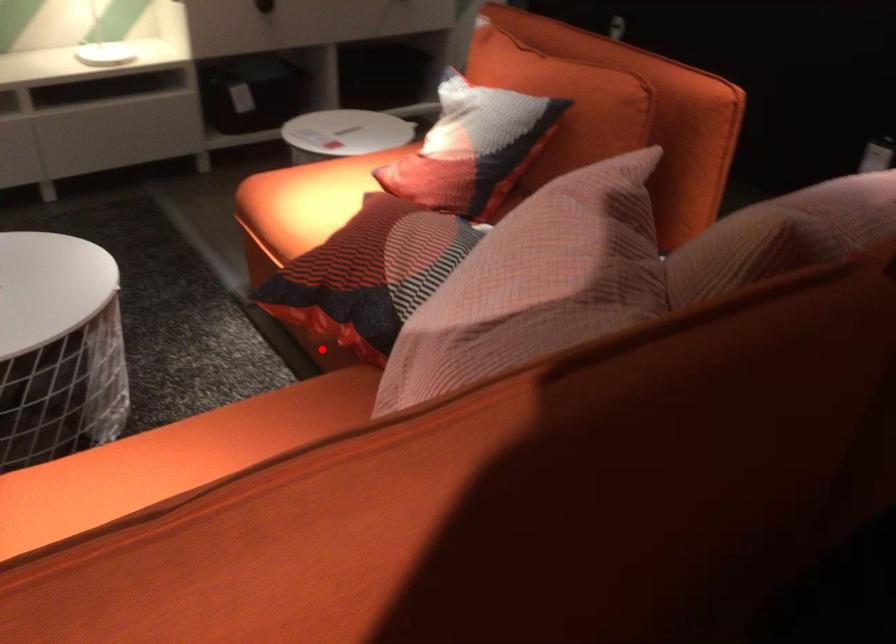
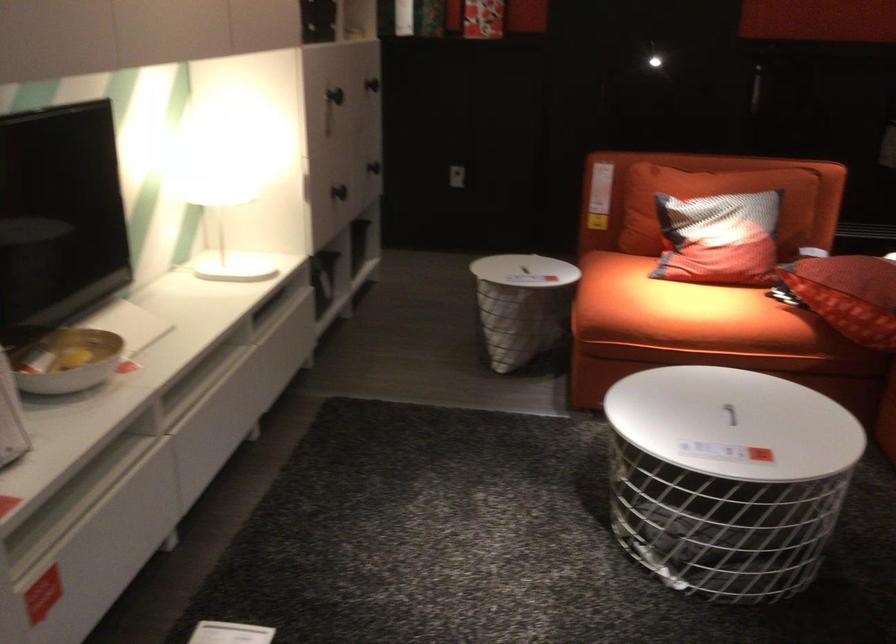
Question: I am providing you with two images of the same scene from different viewpoints. A red point is marked on the first image. Is the red point's position out of view in image 2?

Choices:
 (A) Yes
 (B) No

Answer: (A)